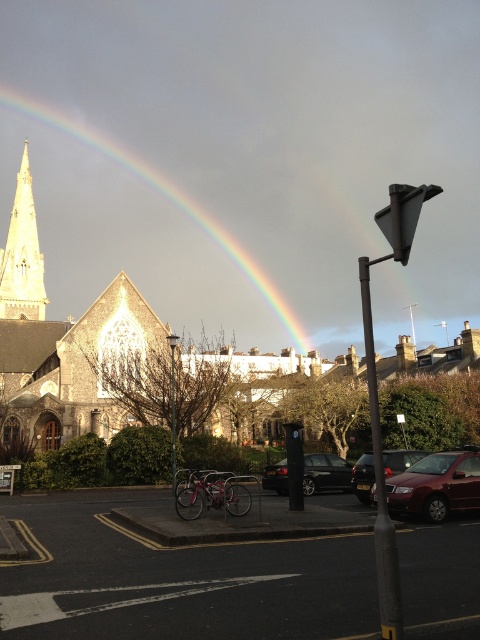
You are a photographer trying to capture the light beige stone spire at upper left and the shiny metallic car at lower right in the same frame. Which object should you focus on first if you want to include both in your photo without moving the camera?

You should focus on the light beige stone spire at upper left first because it is larger and will require more attention to frame properly, ensuring both objects fit in the shot.

You are a photographer trying to capture both the light beige stone spire at upper left and the shiny metallic car at lower right in the same frame. Which object should you focus on first to ensure both are in focus?

You should focus on the light beige stone spire at upper left first because it is closer to you than the shiny metallic car at lower right. By focusing on the closer object, both will be in focus due to the depth of field.

You are a photographer trying to capture the rainbow in the image. You notice a point at coordinates [166,204]. What is the significance of this point in relation to the rainbow?

The point at coordinates [166,204] indicates the location of the rainbow translucent at upper center, which is where the rainbow appears most vividly against the cloudy sky.